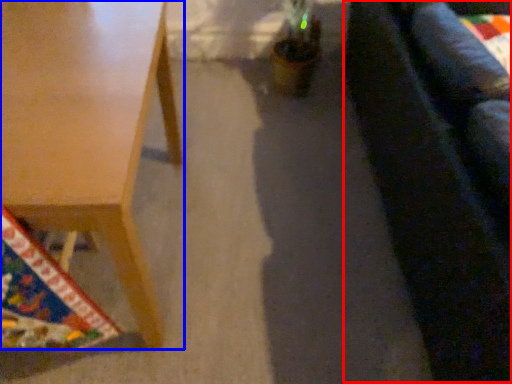
Question: Which object appears farthest to the camera in this image, couch (highlighted by a red box) or table (highlighted by a blue box)?

Choices:
 (A) couch
 (B) table

Answer: (B)